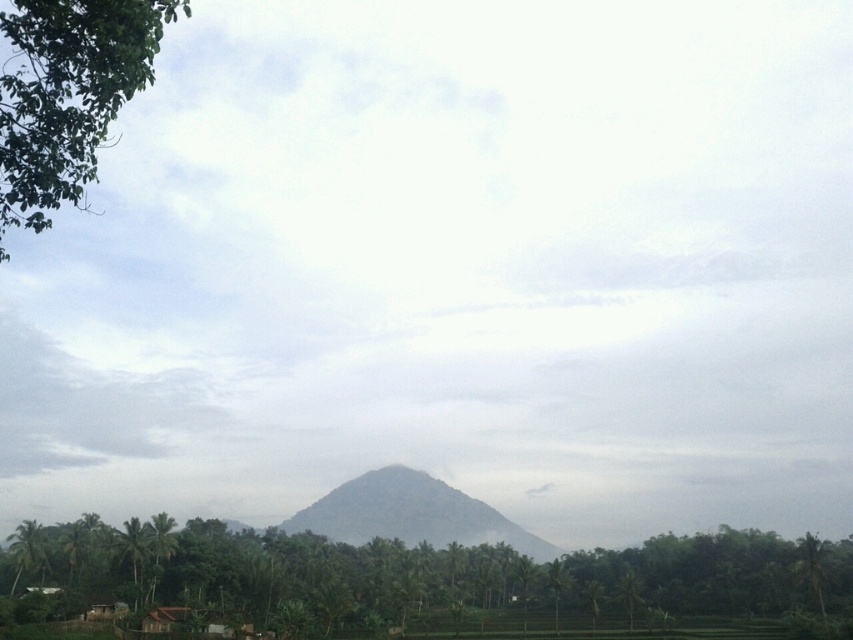
Question: Is green leafy trees at center wider than green leafy tree at upper left?

Choices:
 (A) yes
 (B) no

Answer: (A)

Question: Based on their relative distances, which object is nearer to the green textured mountain at center?

Choices:
 (A) green leafy tree at upper left
 (B) green leafy trees at center

Answer: (B)

Question: Is green leafy trees at center in front of green leafy tree at upper left?

Choices:
 (A) no
 (B) yes

Answer: (A)

Question: Does green leafy trees at center appear on the left side of green textured mountain at center?

Choices:
 (A) yes
 (B) no

Answer: (B)

Question: Which object is farther from the camera taking this photo?

Choices:
 (A) green leafy tree at upper left
 (B) green leafy trees at center
 (C) green textured mountain at center

Answer: (C)

Question: Which object is positioned farthest from the green leafy trees at center?

Choices:
 (A) green textured mountain at center
 (B) green leafy tree at upper left

Answer: (A)